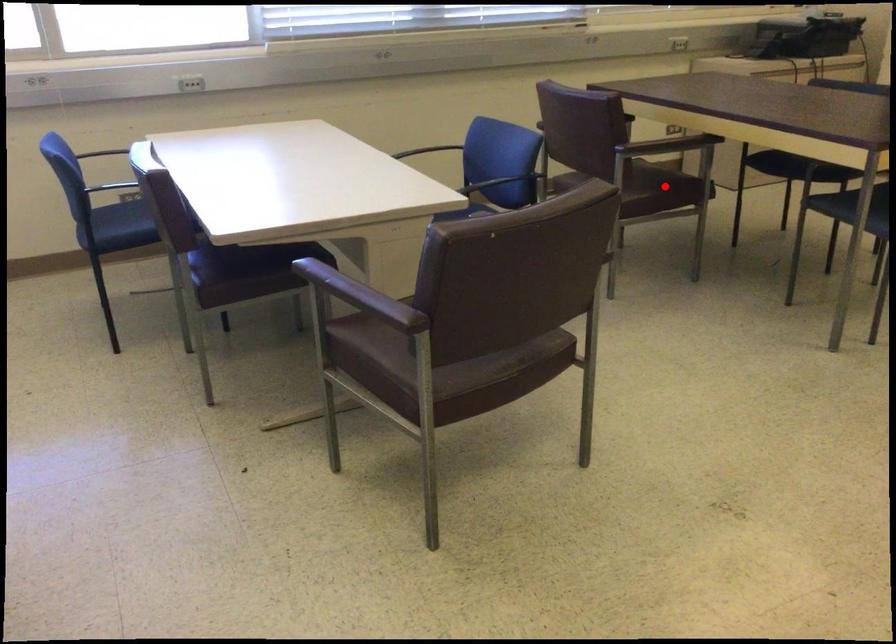
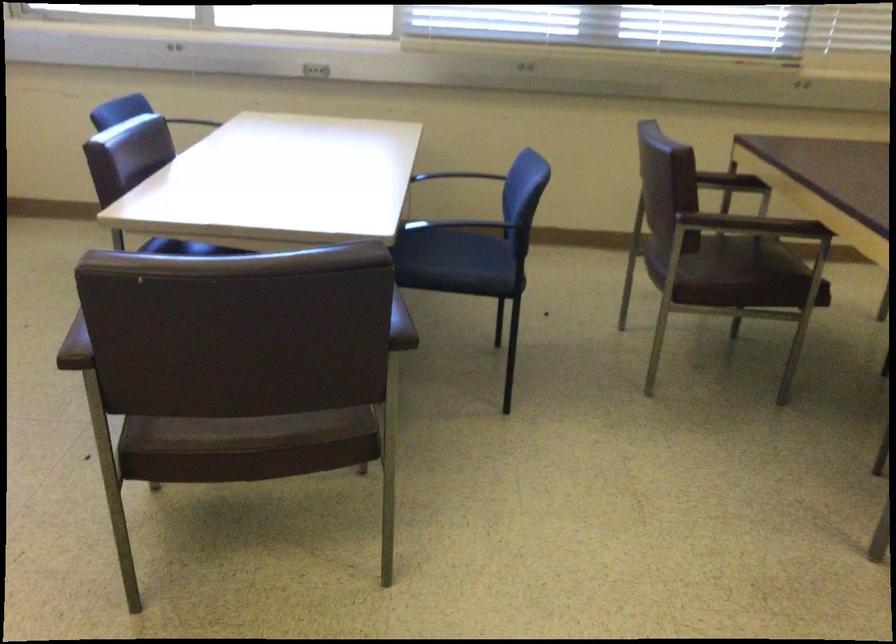
Find the pixel in the second image that matches the highlighted location in the first image.

(739, 278)